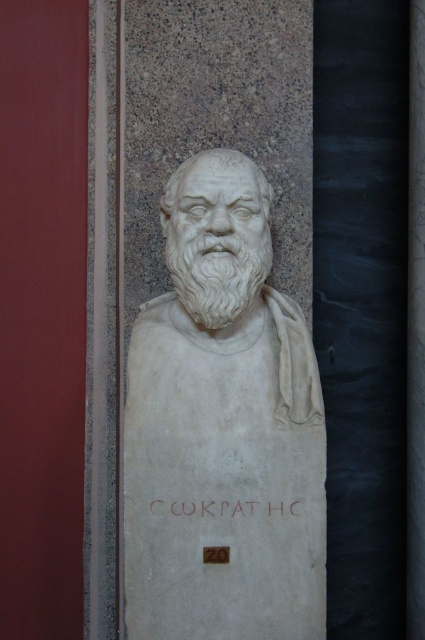
You are an art student standing in front of the white marble bust at center and the white stone inscription at center. Which object is closer to you?

The white marble bust at center is closer to you since it is in front of the white stone inscription at center.

Based on the photo, you are an art conservator assessing the placement of the white marble bust at center and the white stone inscription at center in the image. Which object takes up more visual space in the composition?

The white marble bust at center has a larger size compared to the white stone inscription at center, so it occupies more visual space in the composition.

You are a museum curator who needs to install a protective glass case around the white marble bust at center and the white stone inscription at center. The case must be large enough to cover both objects without touching them. What is the minimum height required for the case to accommodate both objects?

The minimum height required for the case must be at least 7.46 inches to ensure both the white marble bust at center and the white stone inscription at center are fully enclosed without touching them.